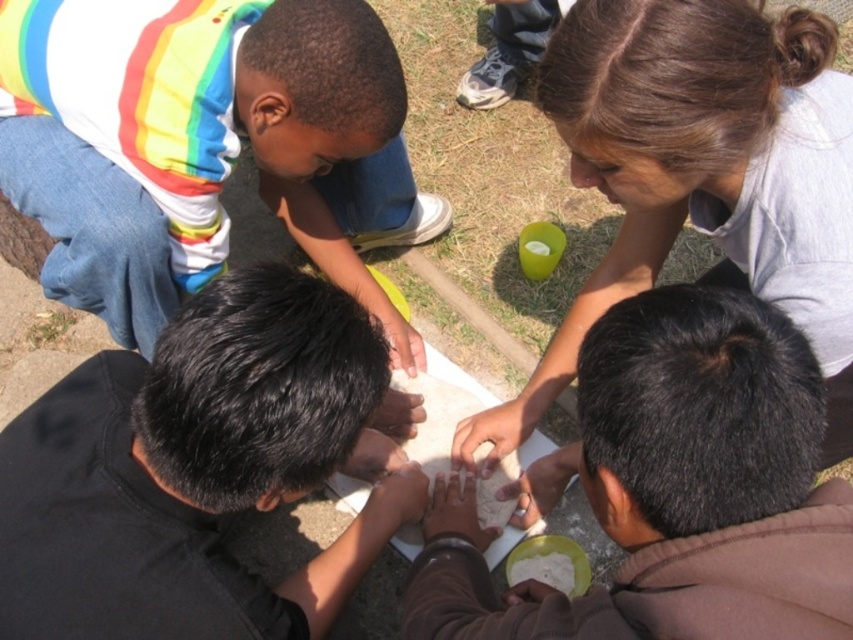
You are a photographer trying to capture a candid shot of the children. You notice the dark brown hair at upper center and the rainbow striped shirt at upper left. Which object should you focus on if you want to photograph the child sitting to the left of the other?

The rainbow striped shirt at upper left is to the left of the dark brown hair at upper center, so you should focus on the rainbow striped shirt at upper left to photograph the child sitting to the left.

You are a photographer trying to capture a clear shot of the dark brown hair at upper center and the rainbow striped shirt at upper left. Based on their heights, which one is more likely to be visible in the photo without obstruction?

The dark brown hair at upper center is more likely to be visible in the photo without obstruction because it has a greater height compared to the rainbow striped shirt at upper left.

You are a photographer trying to capture a candid shot of the children. You notice the black matte shirt at center and the dark brown hair at upper center. Which of these two is positioned to the right side of the other?

The dark brown hair at upper center is to the right of the black matte shirt at center.